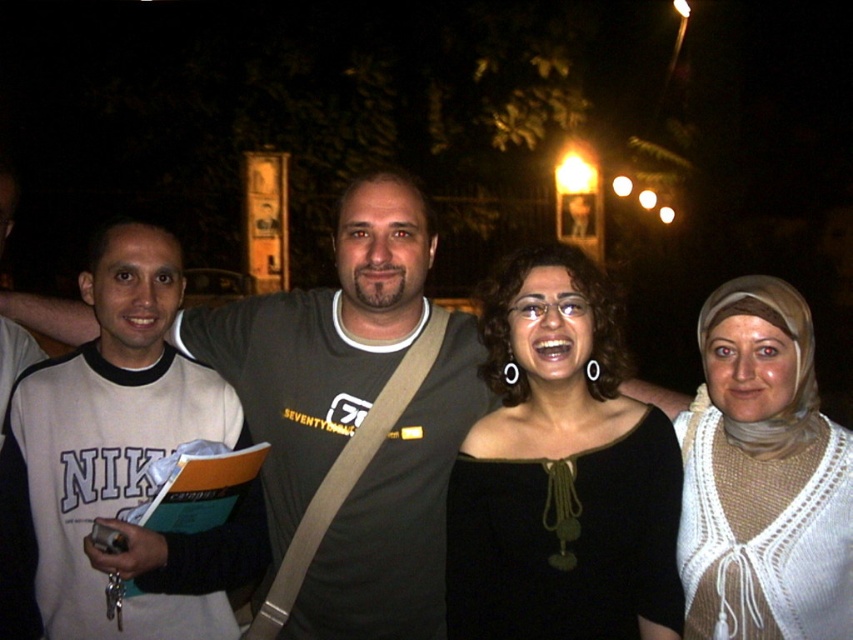
Is black matte top at center positioned at the back of gray cotton shirt at center?

That is False.

Between black matte top at center and gray cotton shirt at center, which one has more height?

black matte top at center

At what (x,y) coordinates should I click in order to perform the action: click on black matte top at center. Please return your answer as a coordinate pair (x, y). Looking at the image, I should click on (560, 472).

Is white knitted scarf at right wider than gray cotton shirt at center?

Correct, the width of white knitted scarf at right exceeds that of gray cotton shirt at center.

In the scene shown: Is white knitted scarf at right behind gray cotton shirt at center?

No, white knitted scarf at right is closer to the viewer.

Who is more forward, (834, 424) or (289, 499)?

Point (834, 424) is more forward.

Find the location of a particular element. This screenshot has width=853, height=640. white knitted scarf at right is located at coordinates (762, 476).

From the picture: Is the position of white cotton shirt at left less distant than that of gray cotton shirt at center?

Yes, white cotton shirt at left is closer to the viewer.

Which of these two, white cotton shirt at left or gray cotton shirt at center, stands shorter?

With less height is gray cotton shirt at center.

Is point (61, 356) positioned before point (364, 260)?

Yes, it is.

You are a GUI agent. You are given a task and a screenshot of the screen. Output one action in this format:
    pyautogui.click(x=<x>, y=<y>)
    Task: Click on the white cotton shirt at left
    This screenshot has width=853, height=640.
    Given the screenshot: What is the action you would take?
    pyautogui.click(x=119, y=461)